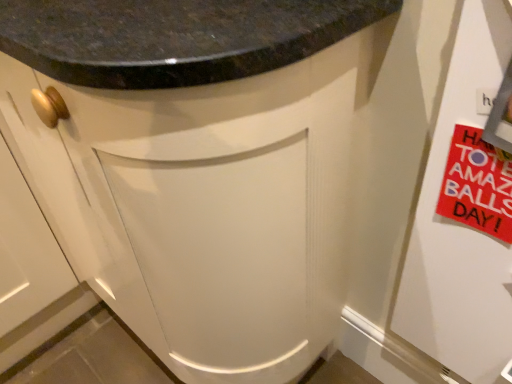
The width and height of the screenshot is (512, 384). What do you see at coordinates (477, 185) in the screenshot?
I see `red paper postcard at right` at bounding box center [477, 185].

Locate an element on the screen. red paper postcard at right is located at coordinates (477, 185).

In order to face red paper postcard at right, should I rotate leftwards or rightwards?

A 28.238 degree turn to the right will do.

This screenshot has height=384, width=512. In order to click on red paper postcard at right in this screenshot , I will do `click(477, 185)`.